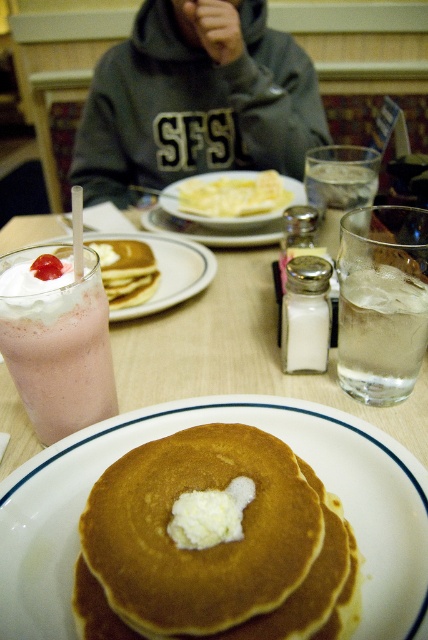
You are a customer at the diner and want to grab the golden brown pancake at center without knocking over the strawberry milkshake at left. Can you reach it safely?

The golden brown pancake at center is in front of the strawberry milkshake at left, so you can reach it safely without knocking over the milkshake.

Looking at this image, you are a customer at the diner and want to take a photo of both the gray hoodie at upper center and the yellow fried egg at center. Which object should you focus on first if you want to capture both in the same frame without moving the camera?

The gray hoodie at upper center is taller than the yellow fried egg at center, so you should focus on the gray hoodie at upper center first to ensure both fit in the frame.